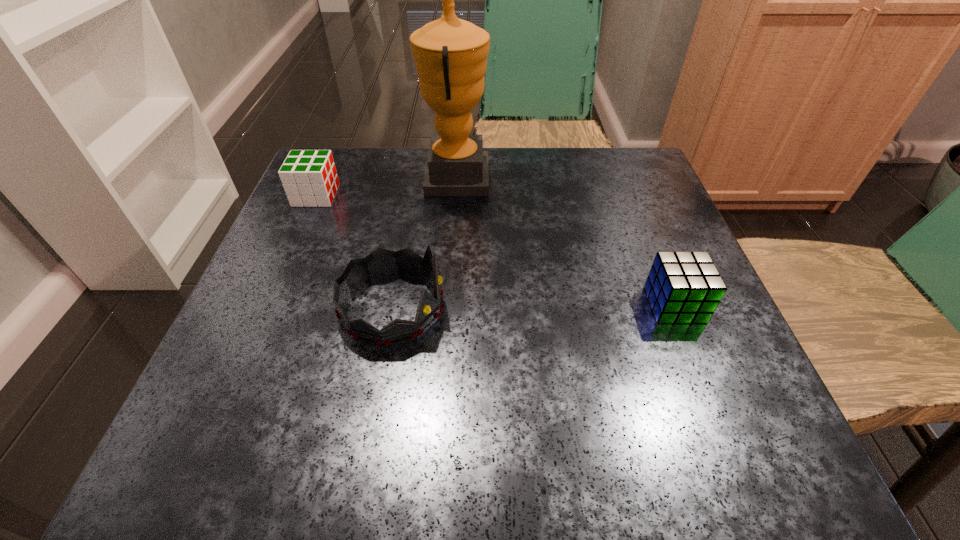
You are a GUI agent. You are given a task and a screenshot of the screen. Output one action in this format:
    pyautogui.click(x=<x>, y=<y>)
    Task: Click on the vacant area at the far left corner of the desktop
    This screenshot has width=960, height=540.
    Given the screenshot: What is the action you would take?
    tap(346, 178)

Find the location of `free space at the near left corner`. free space at the near left corner is located at coordinates (201, 465).

The width and height of the screenshot is (960, 540). Identify the location of vacant space at the far right corner of the desktop. [x=590, y=194].

Locate an element on the screen. The height and width of the screenshot is (540, 960). vacant space at the near right corner of the desktop is located at coordinates (709, 444).

Where is `unoccupied position between the third shortest object and the award`? The image size is (960, 540). unoccupied position between the third shortest object and the award is located at coordinates (424, 243).

Locate an element on the screen. free space between the rightmost object and the tiara is located at coordinates point(534,306).

Identify the location of free point between the leftmost object and the tiara. [354, 252].

Where is `unoccupied position between the tiara and the farther cube`? The width and height of the screenshot is (960, 540). unoccupied position between the tiara and the farther cube is located at coordinates (354, 252).

The width and height of the screenshot is (960, 540). In order to click on vacant area that lies between the nearer cube and the tallest object in this screenshot , I will do `click(565, 241)`.

I want to click on empty space between the tallest object and the rightmost object, so click(565, 241).